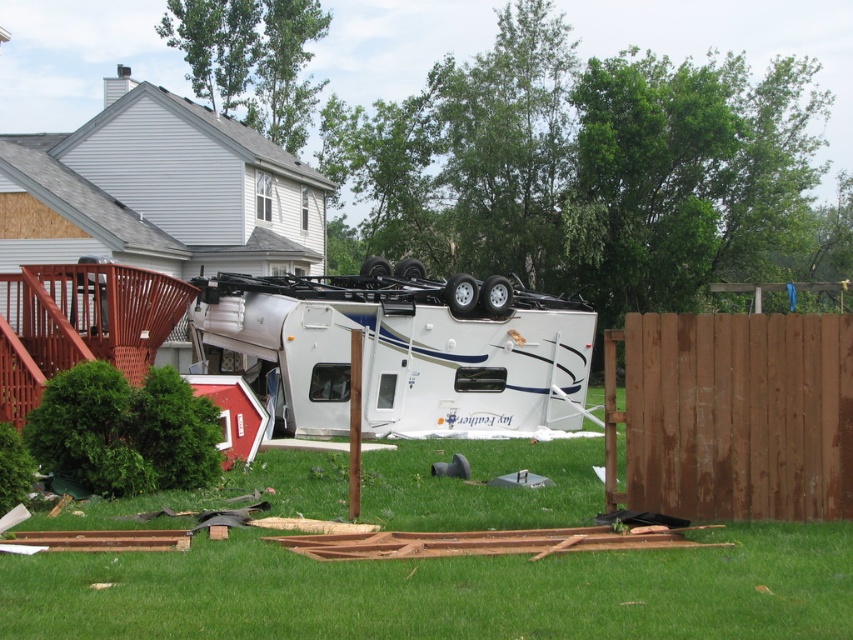
Question: Which of the following is the farthest from the observer?

Choices:
 (A) (645, 502)
 (B) (831, 536)

Answer: (A)

Question: Which object is the farthest from the white glossy trailer truck at center?

Choices:
 (A) brown wooden fence at right
 (B) green grass at center

Answer: (A)

Question: Does green grass at center lie behind brown wooden fence at right?

Choices:
 (A) no
 (B) yes

Answer: (A)

Question: Does green grass at center appear under brown wooden fence at right?

Choices:
 (A) no
 (B) yes

Answer: (B)

Question: Estimate the real-world distances between objects in this image. Which object is closer to the white glossy trailer truck at center?

Choices:
 (A) green grass at center
 (B) brown wooden fence at right

Answer: (A)

Question: Observing the image, what is the correct spatial positioning of green grass at center in reference to brown wooden fence at right?

Choices:
 (A) left
 (B) right

Answer: (A)